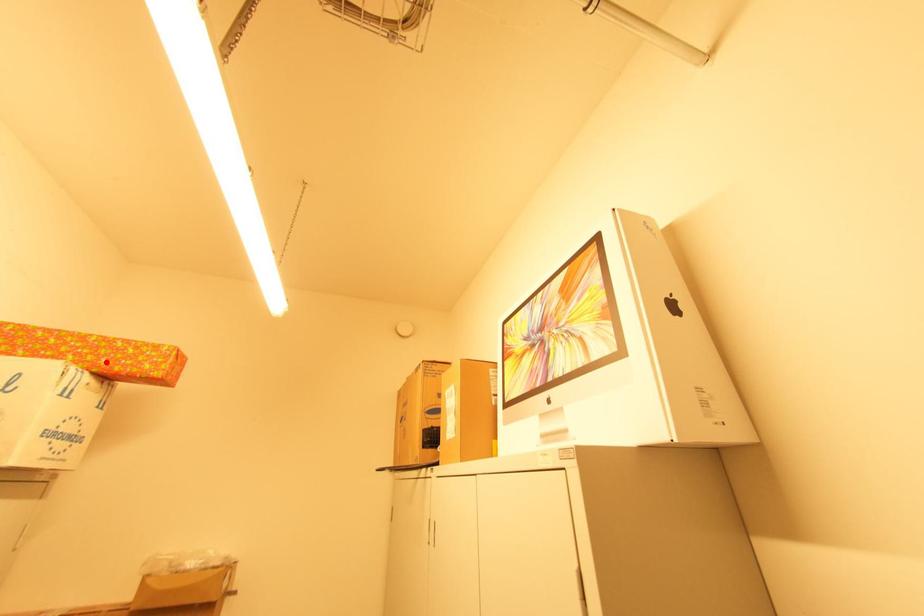
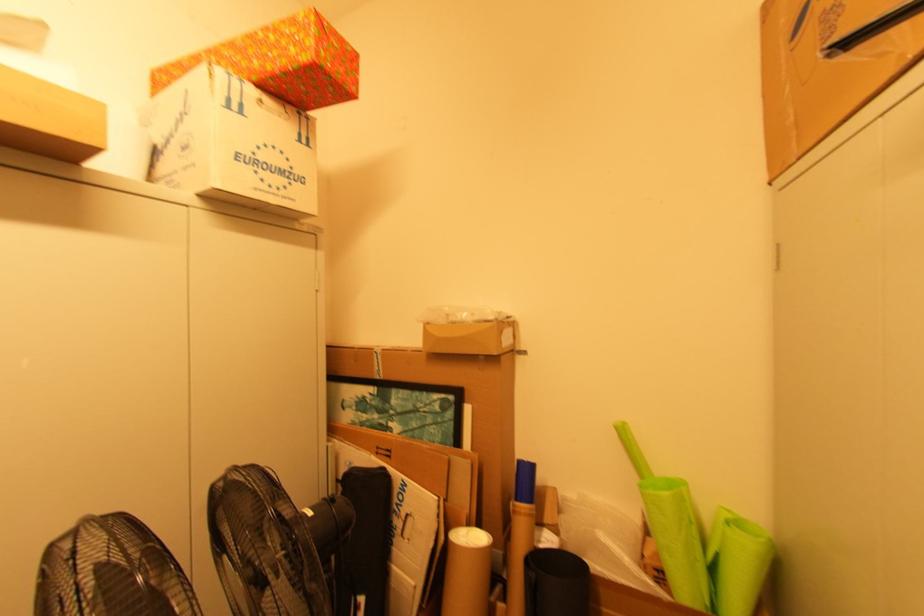
In the second image, find the point that corresponds to the highlighted location in the first image.

(258, 63)